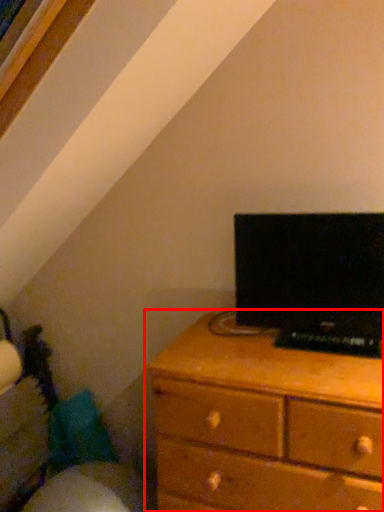
Question: From the image's perspective, considering the relative positions of chest of drawers (annotated by the red box) and computer in the image provided, where is chest of drawers (annotated by the red box) located with respect to the staircase?

Choices:
 (A) below
 (B) above

Answer: (A)